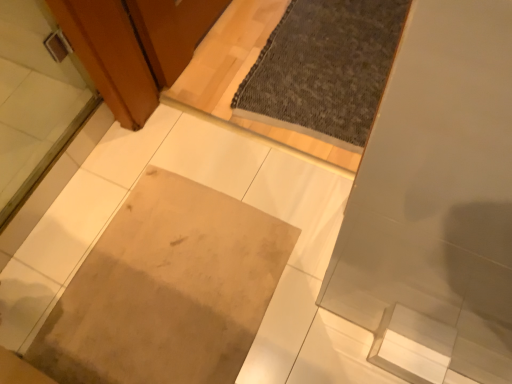
Identify the location of dark gray textured mat at upper center. (325, 69).

Image resolution: width=512 pixels, height=384 pixels. What do you see at coordinates (325, 69) in the screenshot? I see `dark gray textured mat at upper center` at bounding box center [325, 69].

Locate an element on the screen. The height and width of the screenshot is (384, 512). dark gray textured mat at upper center is located at coordinates (325, 69).